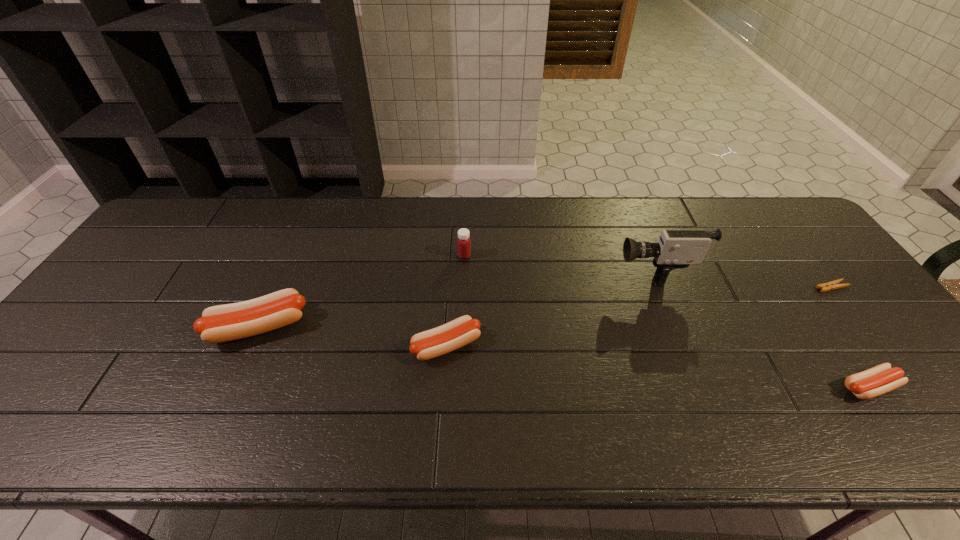
The width and height of the screenshot is (960, 540). In order to click on the leftmost sausage in this screenshot , I will do `click(221, 323)`.

Where is `the leftmost object`? the leftmost object is located at coordinates (221, 323).

Locate an element on the screen. The height and width of the screenshot is (540, 960). the second tallest sausage is located at coordinates (457, 333).

The image size is (960, 540). In order to click on the third shortest object in this screenshot , I will do `click(457, 333)`.

Image resolution: width=960 pixels, height=540 pixels. Find the location of `the second shortest object`. the second shortest object is located at coordinates (880, 379).

Where is `the nearest sausage`? The width and height of the screenshot is (960, 540). the nearest sausage is located at coordinates (880, 379).

Find the location of a particular element. This screenshot has height=540, width=960. clothespin is located at coordinates pos(832,285).

At what (x,y) coordinates should I click in order to perform the action: click on medicine. Please return your answer as a coordinate pair (x, y). Looking at the image, I should click on (x=463, y=243).

The height and width of the screenshot is (540, 960). In order to click on the fourth object from left to right in this screenshot , I will do `click(676, 249)`.

The height and width of the screenshot is (540, 960). Identify the location of the tallest object. (676, 249).